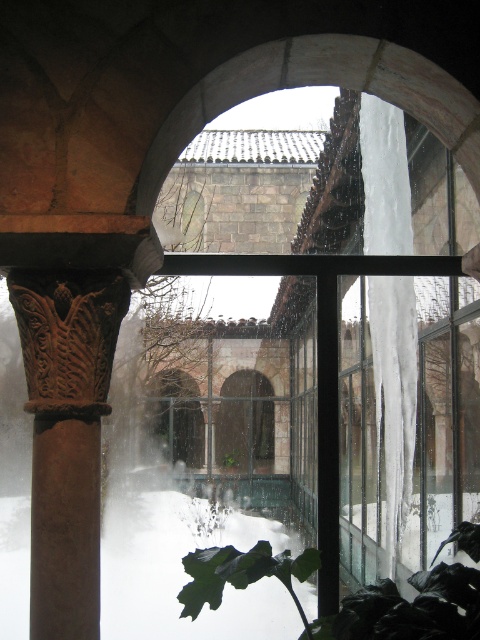
You are an interior designer assessing the placement of the green matte leaf at lower center in the arched stone window. Based on its coordinates at point 0.933, 0.721, is it positioned closer to the bottom or the top of the window frame?

The green matte leaf at lower center is located at point [346,596], which means it is closer to the bottom of the window frame since the y coordinate 0.721 is closer to 1.0, which typically represents the bottom in coordinate systems.

You are standing in the courtyard looking through the arched window into the snowing scene. There are two points marked in the image. The first point is at coordinates point (88, 605) and the second point is at point (239, 451). Which of these two points is closer to you as you look through the window?

→ Point (88, 605) is closer to you because it is in front of point (239, 451).